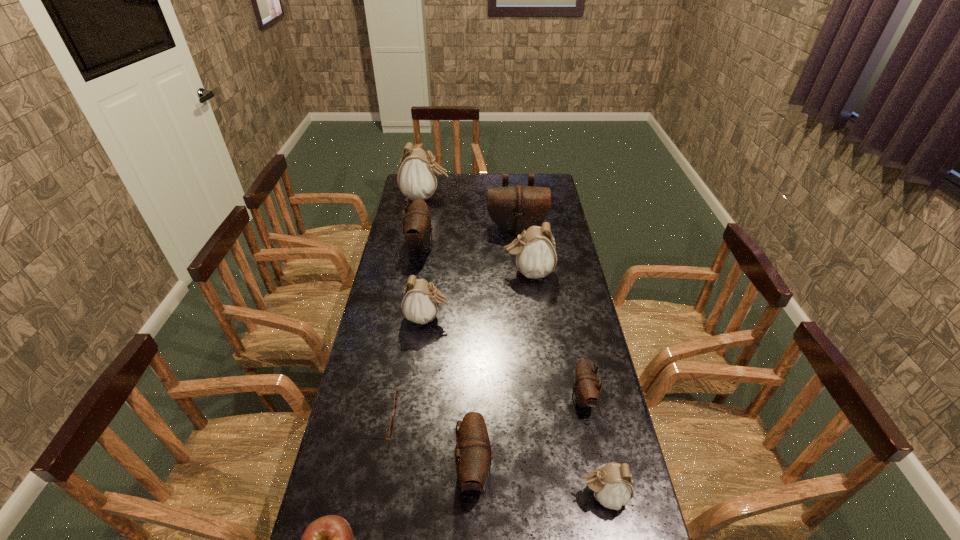
Find the location of a particular element. This screenshot has height=540, width=960. the third nearest pouch is located at coordinates (586, 389).

Where is `the shortest object`? the shortest object is located at coordinates (396, 393).

At what (x,y) coordinates should I click in order to perform the action: click on free spot located on the front-facing side of the farthest white pouch. Please return your answer as a coordinate pair (x, y). Looking at the image, I should click on (529, 197).

At what (x,y) coordinates should I click in order to perform the action: click on vacant space located with the flap open on the biggest brown pouch. Please return your answer as a coordinate pair (x, y). This screenshot has height=540, width=960. Looking at the image, I should click on (x=521, y=266).

The width and height of the screenshot is (960, 540). What are the coordinates of `vacant area situated 0.210m on the front-facing side of the third smallest white pouch` in the screenshot? It's located at click(449, 272).

Locate an element on the screen. vacant space located 0.300m on the front-facing side of the third smallest white pouch is located at coordinates (427, 272).

Identify the location of free location located on the front-facing side of the third smallest white pouch. This screenshot has width=960, height=540. (460, 272).

Where is `free region located with the flap open on the second biggest brown pouch`? The width and height of the screenshot is (960, 540). free region located with the flap open on the second biggest brown pouch is located at coordinates (509, 245).

Locate an element on the screen. free point located on the front-facing side of the third biggest white pouch is located at coordinates (484, 318).

Locate an element on the screen. Image resolution: width=960 pixels, height=540 pixels. free location located 0.070m with the flap open on the nearest brown pouch is located at coordinates (518, 469).